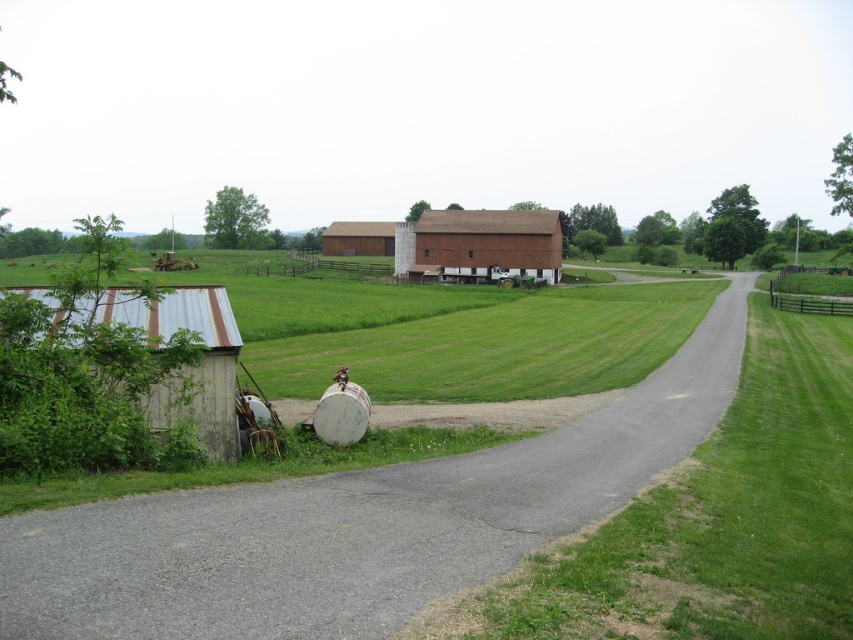
You are standing at the point marked by the coordinate point at [192,368] on a rural farm map. What structure are you currently standing on?

You are standing on the rusty corrugated metal shed at lower left.

You are a delivery driver approaching the gray asphalt road at center and the rusty corrugated metal shed at lower left. Which object is taller?

The rusty corrugated metal shed at lower left is taller than the gray asphalt road at center.

You are driving a tractor that is 4 meters wide. You want to pass between the gray asphalt road at center and the white silo on the right. Is there enough space for your tractor to fit through?

The distance between the gray asphalt road at center and the white silo on the right is 4.44 meters, which is wider than the tractor width of 4 meters. Therefore, the tractor can safely pass through the space between them.